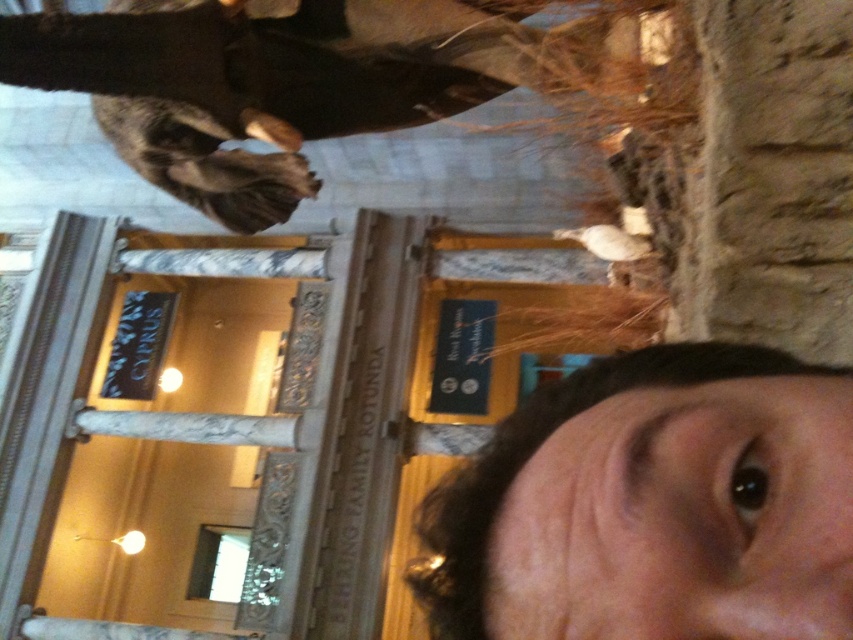
You are standing in a museum and see the smooth skin face at lower right and the shiny black coat at upper center in the image. Which object is positioned more to the right side of the image?

The smooth skin face at lower right is positioned more to the right side of the image compared to the shiny black coat at upper center.

You are a photographer trying to capture a clear shot of the shiny black coat at upper center without the smooth skin face at lower right blocking it. Given their sizes, which object should you focus on to ensure it fills the frame adequately?

The shiny black coat at upper center is larger than the smooth skin face at lower right, so focusing on the shiny black coat at upper center would allow it to fill the frame better without obstruction.